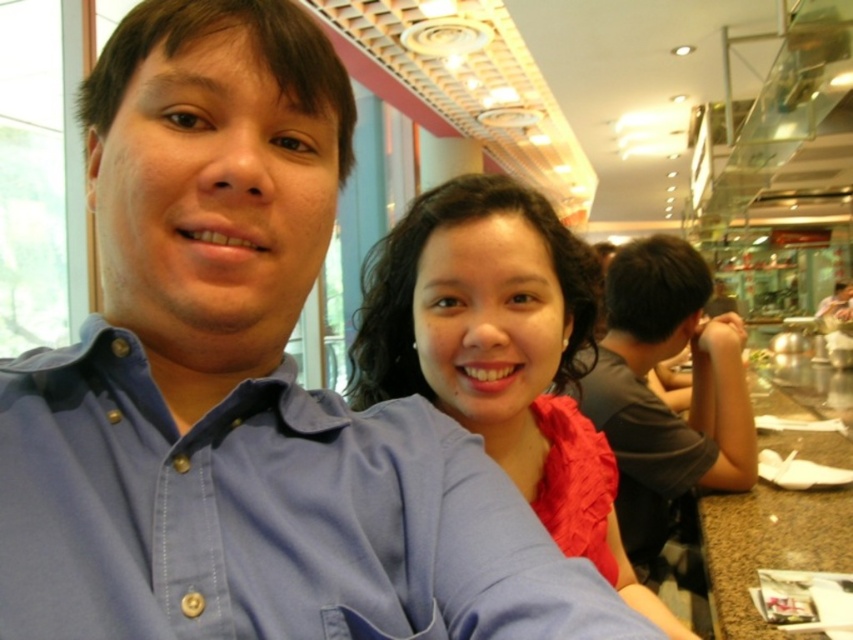
Question: Considering the real-world distances, which object is farthest from the matte blue shirt at center?

Choices:
 (A) dark gray t-shirt at right
 (B) blue cotton shirt at center

Answer: (B)

Question: Can you confirm if blue cotton shirt at center is wider than matte blue shirt at center?

Choices:
 (A) no
 (B) yes

Answer: (A)

Question: Estimate the real-world distances between objects in this image. Which object is farther from the dark gray t-shirt at right?

Choices:
 (A) matte blue shirt at center
 (B) smooth granite table at lower right
 (C) blue cotton shirt at center

Answer: (C)

Question: Is blue cotton shirt at center to the right of dark gray t-shirt at right from the viewer's perspective?

Choices:
 (A) no
 (B) yes

Answer: (A)

Question: Which object appears closest to the camera in this image?

Choices:
 (A) blue cotton shirt at center
 (B) dark gray t-shirt at right

Answer: (A)

Question: Is matte blue shirt at center below smooth granite table at lower right?

Choices:
 (A) yes
 (B) no

Answer: (B)